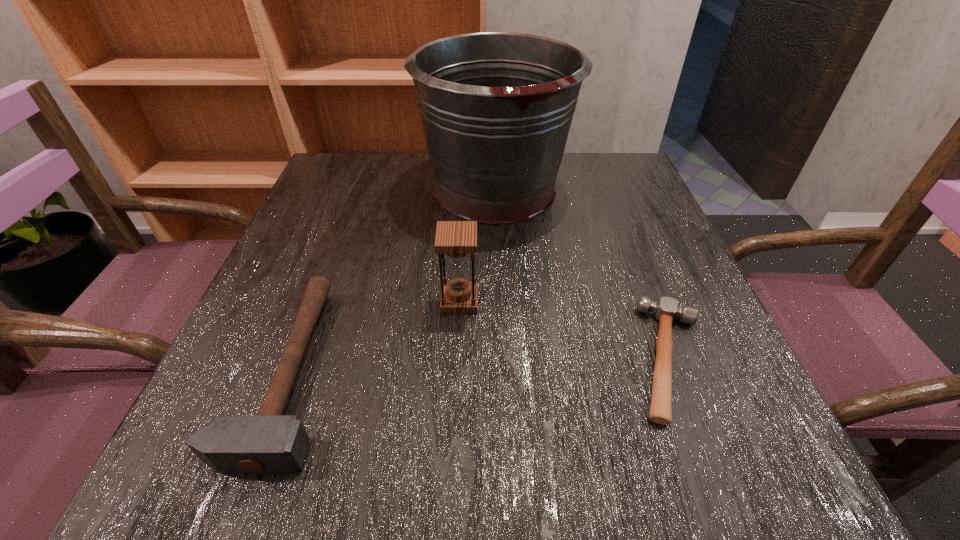
The width and height of the screenshot is (960, 540). What are the coordinates of `free location located 0.180m on the left of the rightmost object` in the screenshot? It's located at (513, 359).

Find the location of a particular element. The width and height of the screenshot is (960, 540). object that is positioned at the far edge is located at coordinates (496, 107).

Image resolution: width=960 pixels, height=540 pixels. Identify the location of object situated at the near edge. pyautogui.click(x=268, y=443).

The height and width of the screenshot is (540, 960). What are the coordinates of `object at the left edge` in the screenshot? It's located at (268, 443).

Image resolution: width=960 pixels, height=540 pixels. In order to click on object at the right edge in this screenshot , I will do pos(666,309).

Locate an element on the screen. Image resolution: width=960 pixels, height=540 pixels. object located at the near left corner is located at coordinates (268, 443).

Image resolution: width=960 pixels, height=540 pixels. Identify the location of vacant space at the far edge of the desktop. (432, 171).

Locate an element on the screen. This screenshot has height=540, width=960. free region at the near edge of the desktop is located at coordinates (639, 440).

The image size is (960, 540). In the image, there is a desktop. Identify the location of vacant space at the left edge. (273, 324).

Identify the location of free space at the right edge. The image size is (960, 540). [x=620, y=234].